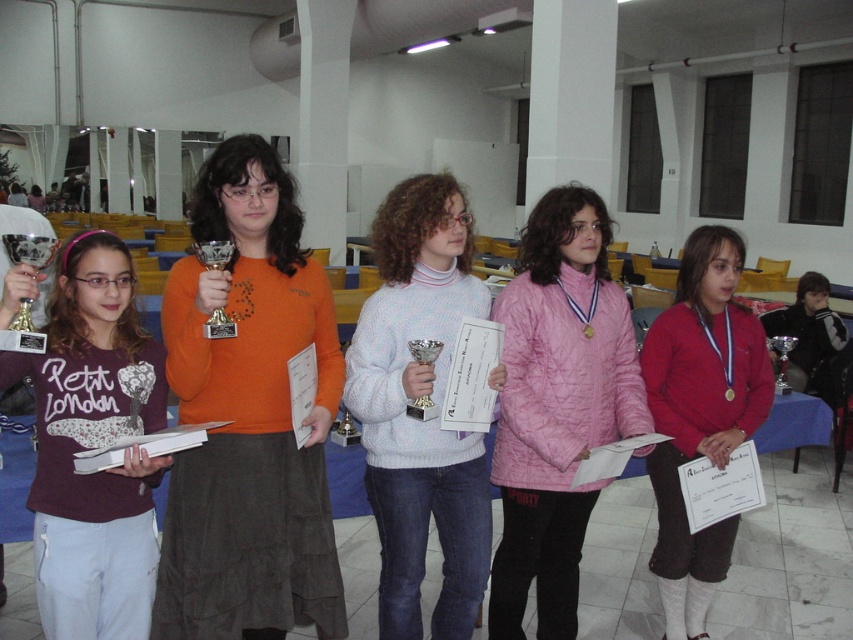
Is orange suede skirt at center taller than pink quilted jacket at center?

Incorrect, orange suede skirt at center's height is not larger of pink quilted jacket at center's.

What do you see at coordinates (248, 417) in the screenshot? I see `orange suede skirt at center` at bounding box center [248, 417].

At what (x,y) coordinates should I click in order to perform the action: click on orange suede skirt at center. Please return your answer as a coordinate pair (x, y). Looking at the image, I should click on (248, 417).

In the scene shown: Between pink quilted jacket at center and gold metallic trophy at center, which one has less height?

gold metallic trophy at center is shorter.

Is pink quilted jacket at center bigger than gold metallic trophy at center?

Correct, pink quilted jacket at center is larger in size than gold metallic trophy at center.

Which is behind, point (570, 513) or point (206, 330)?

Point (570, 513)

The width and height of the screenshot is (853, 640). Identify the location of pink quilted jacket at center. (556, 404).

Between metallic silver trophy at left and gold metallic trophy at center, which one is positioned higher?

metallic silver trophy at left

Is metallic silver trophy at left below gold metallic trophy at center?

Incorrect, metallic silver trophy at left is not positioned below gold metallic trophy at center.

You are a GUI agent. You are given a task and a screenshot of the screen. Output one action in this format:
    pyautogui.click(x=<x>, y=<y>)
    Task: Click on the metallic silver trophy at left
    The width and height of the screenshot is (853, 640).
    Given the screenshot: What is the action you would take?
    pyautogui.click(x=28, y=248)